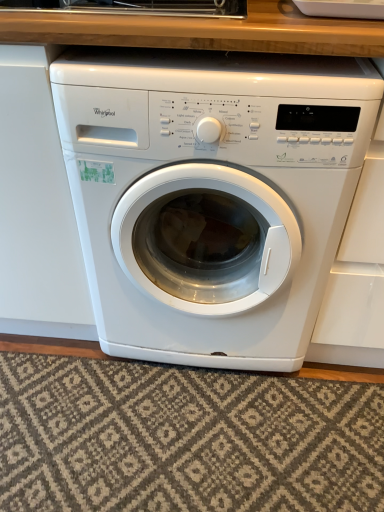
Question: Is white glossy washing machine at center bigger or smaller than textured beige rug at lower center?

Choices:
 (A) big
 (B) small

Answer: (A)

Question: From the image's perspective, is white glossy washing machine at center above or below textured beige rug at lower center?

Choices:
 (A) below
 (B) above

Answer: (B)

Question: Visually, is white glossy washing machine at center positioned to the left or to the right of textured beige rug at lower center?

Choices:
 (A) right
 (B) left

Answer: (A)

Question: Is textured beige rug at lower center wider or thinner than white glossy washing machine at center?

Choices:
 (A) thin
 (B) wide

Answer: (A)

Question: From their relative heights in the image, would you say textured beige rug at lower center is taller or shorter than white glossy washing machine at center?

Choices:
 (A) tall
 (B) short

Answer: (B)

Question: In the image, is textured beige rug at lower center on the left side or the right side of white glossy washing machine at center?

Choices:
 (A) left
 (B) right

Answer: (A)

Question: Is textured beige rug at lower center bigger or smaller than white glossy washing machine at center?

Choices:
 (A) small
 (B) big

Answer: (A)